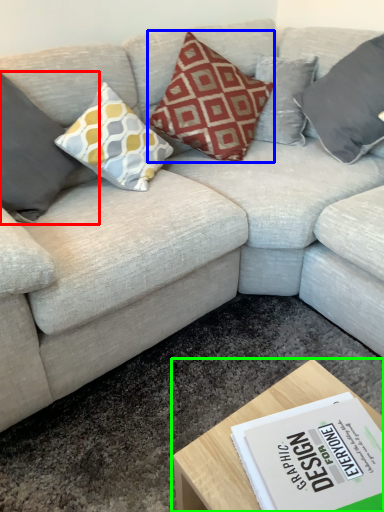
Question: Which is nearer to the pillow (highlighted by a red box)? pillow (highlighted by a blue box) or coffee table (highlighted by a green box).

Choices:
 (A) pillow
 (B) coffee table

Answer: (A)